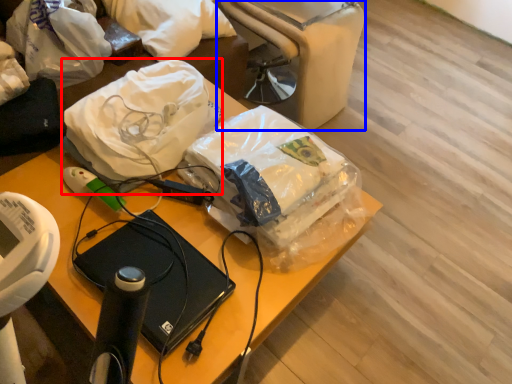
Question: Among these objects, which one is nearest to the camera, plastic bag (highlighted by a red box) or bean bag chair (highlighted by a blue box)?

Choices:
 (A) plastic bag
 (B) bean bag chair

Answer: (A)